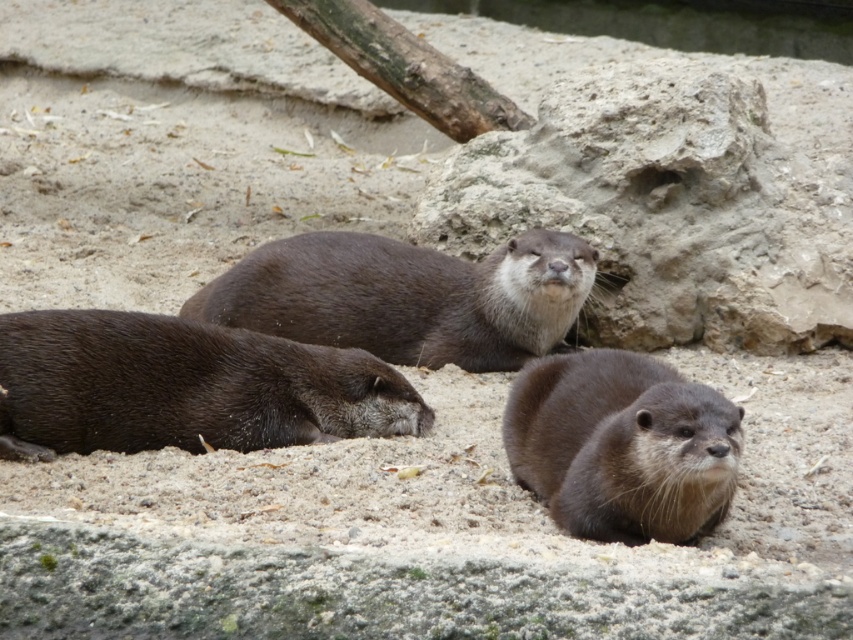
You are a zookeeper observing the otters in their enclosure. You notice the shiny brown otter at lower left and the brown furry otter at lower right. Which otter is physically closer to you, the observer?

The shiny brown otter at lower left is physically closer to you because it is positioned over the brown furry otter at lower right, indicating it is in front.

You are a zookeeper who needs to feed two otters. You have a food tray that can be placed between them. The minimum distance required between the otters and the food tray is 1 meter to ensure they both can reach comfortably. Given the distance between the brown fur otter at center and the brown furry otter at lower right, can you place the food tray between them so that both otters can reach it comfortably?

The brown fur otter at center is 99.92 centimeters from brown furry otter at lower right. Since 99.92 centimeters is less than 1 meter, placing the food tray between them would mean the distance from each otter to the tray would be less than 50 cm, which is below the required 1 meter minimum. Therefore, the food tray cannot be placed between them to meet the comfort requirement.

You are observing the otters in the zoo enclosure. You notice the shiny brown otter at lower left and the brown furry otter at lower right. Which otter is shorter in height?

The shiny brown otter at lower left is not as tall as the brown furry otter at lower right, so the shiny brown otter at lower left is shorter in height.